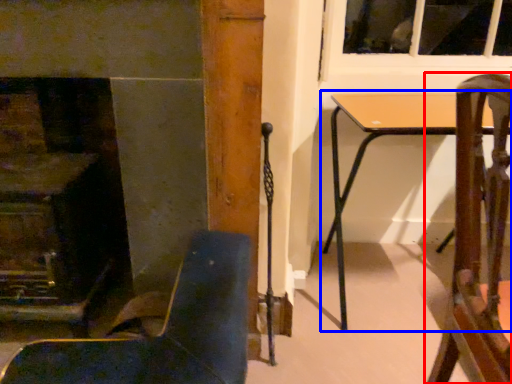
Question: Which of the following is the closest to the observer, chair (highlighted by a red box) or table (highlighted by a blue box)?

Choices:
 (A) chair
 (B) table

Answer: (A)